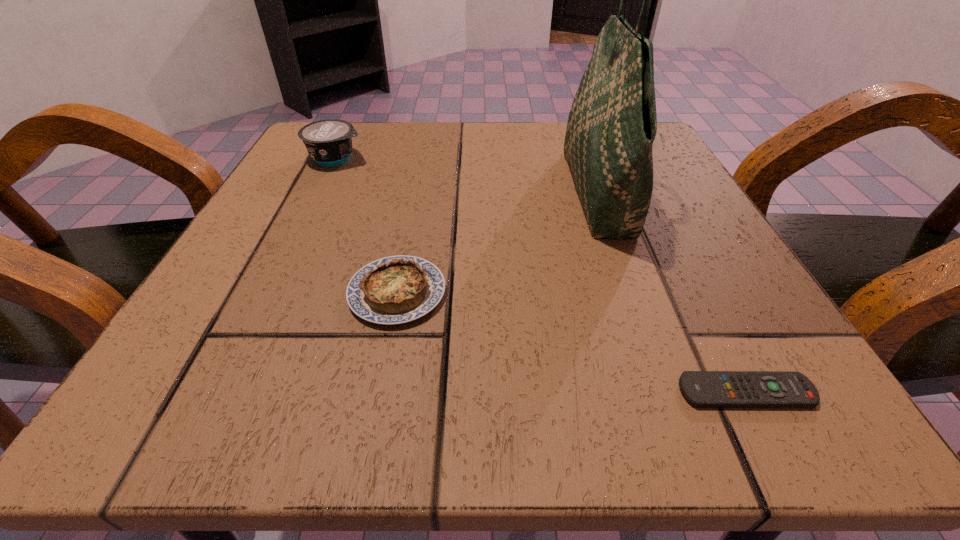
Identify the location of the tallest object. This screenshot has width=960, height=540. (612, 124).

Locate an element on the screen. This screenshot has height=540, width=960. yogurt is located at coordinates (329, 142).

Find the location of a particular element. The image size is (960, 540). the second tallest object is located at coordinates (329, 142).

You are a GUI agent. You are given a task and a screenshot of the screen. Output one action in this format:
    pyautogui.click(x=<x>, y=<y>)
    Task: Click on the third object from right to left
    The width and height of the screenshot is (960, 540).
    Given the screenshot: What is the action you would take?
    pyautogui.click(x=397, y=289)

Locate an element on the screen. The image size is (960, 540). quiche is located at coordinates (397, 289).

The image size is (960, 540). I want to click on the shortest object, so click(x=704, y=389).

You are a GUI agent. You are given a task and a screenshot of the screen. Output one action in this format:
    pyautogui.click(x=<x>, y=<y>)
    Task: Click on the remote control
    The width and height of the screenshot is (960, 540).
    Given the screenshot: What is the action you would take?
    pyautogui.click(x=704, y=389)

Where is `free space located on the left of the tallest object`? Image resolution: width=960 pixels, height=540 pixels. free space located on the left of the tallest object is located at coordinates (437, 193).

At what (x,y) coordinates should I click in order to perform the action: click on blank space located on the right of the leftmost object. Please return your answer as a coordinate pair (x, y). Looking at the image, I should click on (468, 158).

Identify the location of vacant area located 0.160m on the left of the third tallest object. (228, 293).